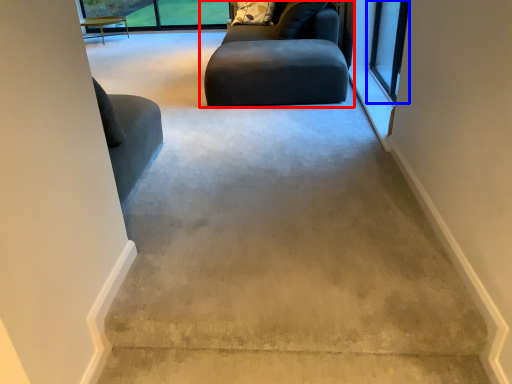
Question: Which object appears closest to the camera in this image, studio couch (highlighted by a red box) or window (highlighted by a blue box)?

Choices:
 (A) studio couch
 (B) window

Answer: (B)